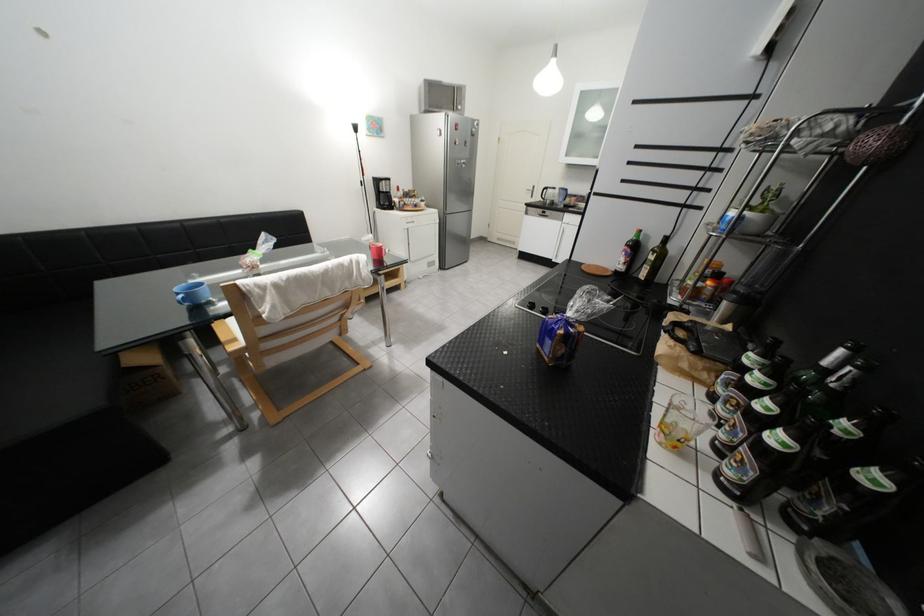
This screenshot has width=924, height=616. What are the coordinates of `coffee carafe handle` in the screenshot? It's located at (393, 200).